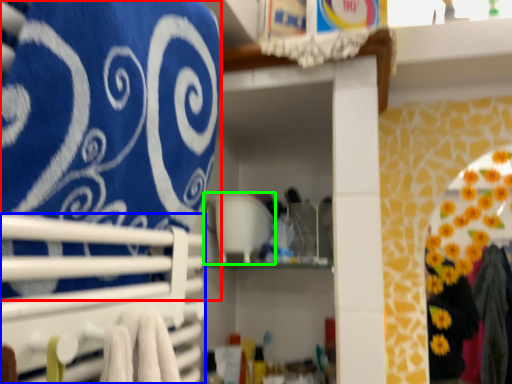
Question: Based on their relative distances, which object is farther from bath towel (highlighted by a red box)? Choose from closet (highlighted by a blue box) and appliance (highlighted by a green box).

Choices:
 (A) closet
 (B) appliance

Answer: (B)